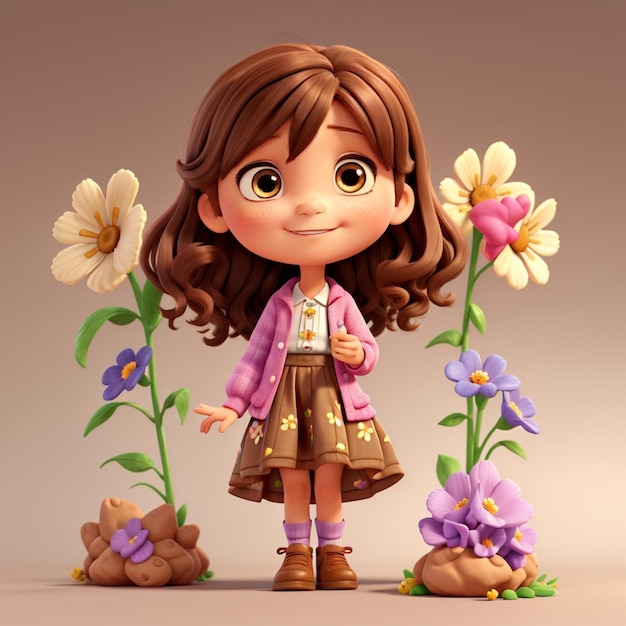
Find the location of a particular element. The height and width of the screenshot is (626, 626). tan backdrop is located at coordinates (32, 34).